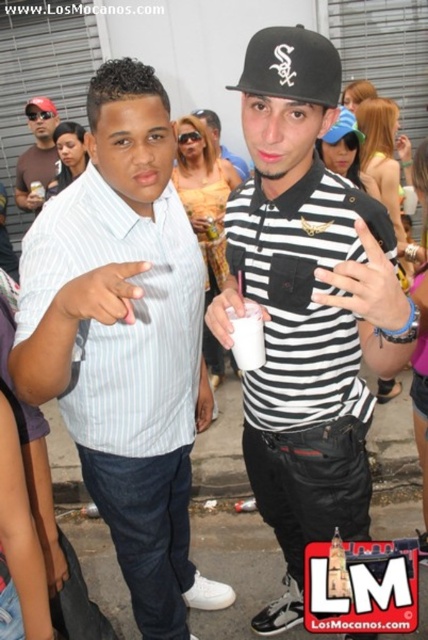
Question: Which point appears closest to the camera in this image?

Choices:
 (A) (56, 150)
 (B) (169, 253)
 (C) (303, 275)

Answer: (C)

Question: Is white striped shirt at left positioned in front of black fabric baseball cap at upper center?

Choices:
 (A) no
 (B) yes

Answer: (B)

Question: Can you confirm if black fabric baseball cap at upper center is wider than matte black polo shirt at center?

Choices:
 (A) yes
 (B) no

Answer: (B)

Question: Which point is closer to the camera?

Choices:
 (A) (88, 284)
 (B) (238, 164)

Answer: (A)

Question: Which of the following is the closest to the observer?

Choices:
 (A) [74, 355]
 (B) [202, 122]

Answer: (A)

Question: Does black fabric baseball cap at upper center appear on the right side of matte black polo shirt at center?

Choices:
 (A) yes
 (B) no

Answer: (A)